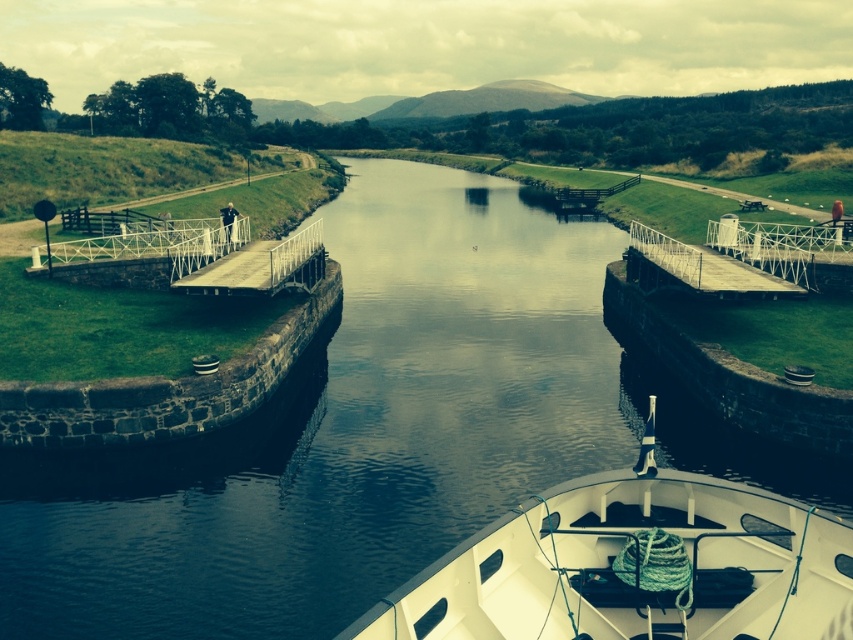
Question: Does white matte boat at center appear over metallic gray dock at center?

Choices:
 (A) yes
 (B) no

Answer: (B)

Question: Which point is farther to the camera?

Choices:
 (A) white matte boat at center
 (B) white metal dock at center

Answer: (B)

Question: Which point is farther from the camera taking this photo?

Choices:
 (A) (479, 625)
 (B) (171, 278)
 (C) (648, 252)

Answer: (C)

Question: Is white metal dock at center in front of metallic gray dock at center?

Choices:
 (A) yes
 (B) no

Answer: (B)

Question: Can you confirm if white metal dock at center is thinner than metallic gray dock at center?

Choices:
 (A) yes
 (B) no

Answer: (B)

Question: Based on their relative distances, which object is farther from the white matte boat at center?

Choices:
 (A) white metal dock at center
 (B) metallic gray dock at center

Answer: (B)